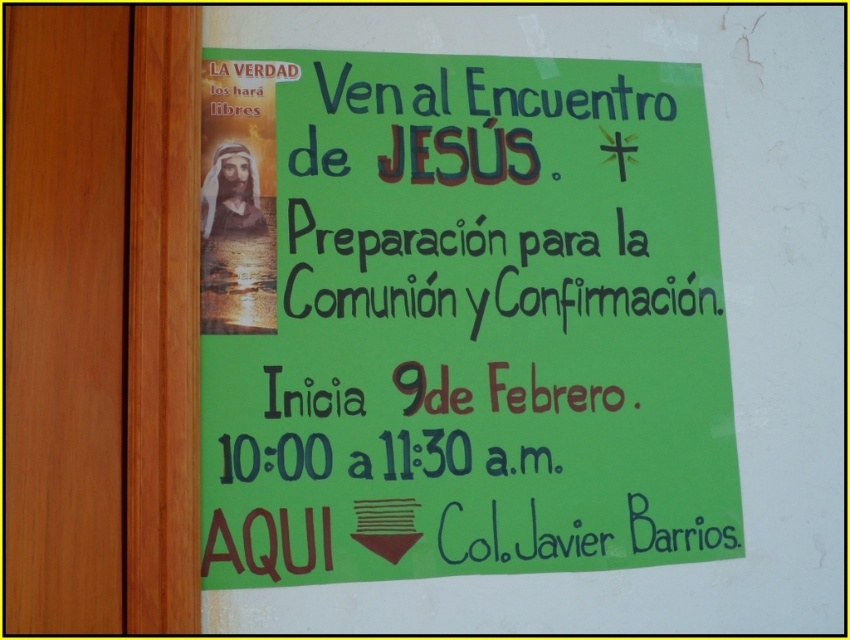
Question: Where is green paper poster at upper center located in relation to brown wood door at left in the image?

Choices:
 (A) right
 (B) left

Answer: (A)

Question: Does green paper poster at upper center have a greater width compared to brown wood door at left?

Choices:
 (A) no
 (B) yes

Answer: (B)

Question: Can you confirm if green paper poster at upper center is wider than brown wood door at left?

Choices:
 (A) yes
 (B) no

Answer: (A)

Question: Which object is closer to the camera taking this photo?

Choices:
 (A) green paper poster at upper center
 (B) brown wood door at left

Answer: (B)